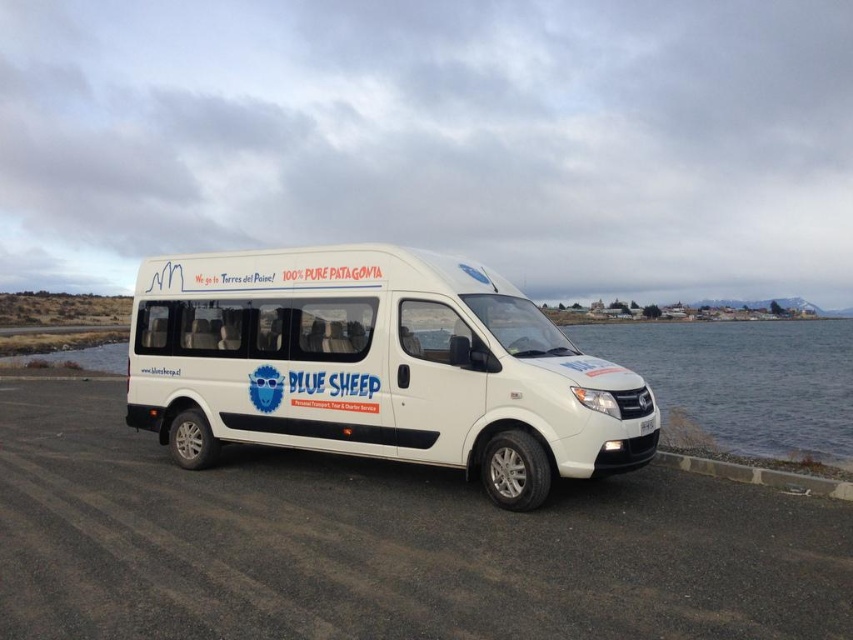
You are a tour guide planning to park the van closer to the water for a photo shoot. The transparent glass water at lower right and the gray concrete curb at lower right are in the path. Which object is higher and might block the van from getting closer?

The transparent glass water at lower right is taller than the gray concrete curb at lower right, so the water might block the van from getting closer.

You are standing in front of the van and want to take a photo. There are two points marked on the van at coordinates point (193, 266) and point (839, 497). Which point should you focus on first if you want to capture the closest part of the van to your camera?

You should focus on point (193, 266) first because it is closer to the camera than point (839, 497), which is further away.